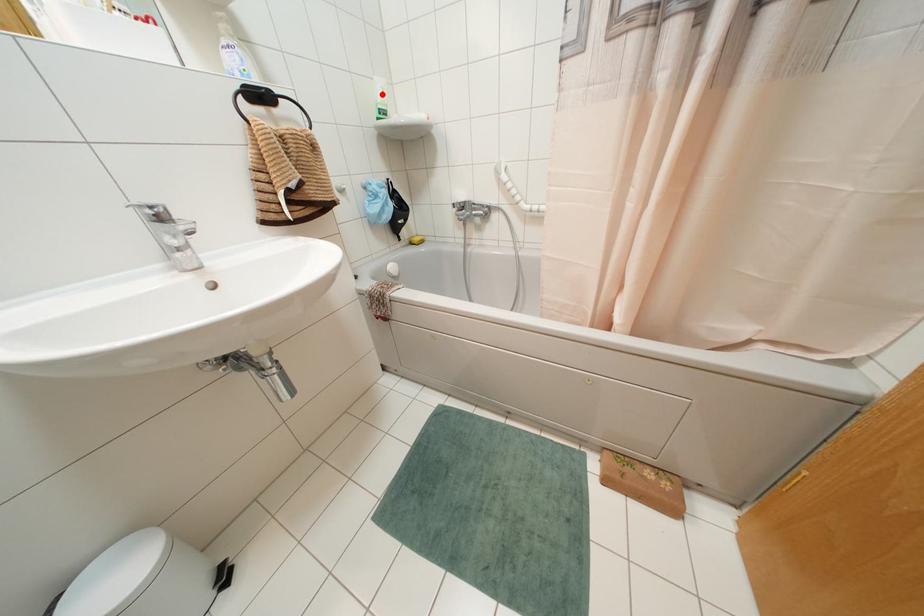
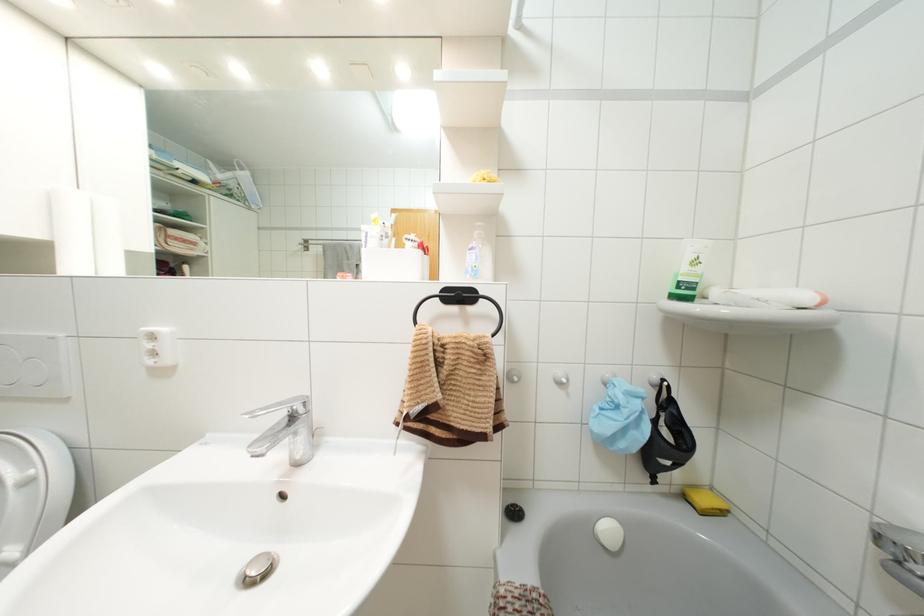
Where in the second image is the point corresponding to the highlighted location from the first image?

(695, 262)